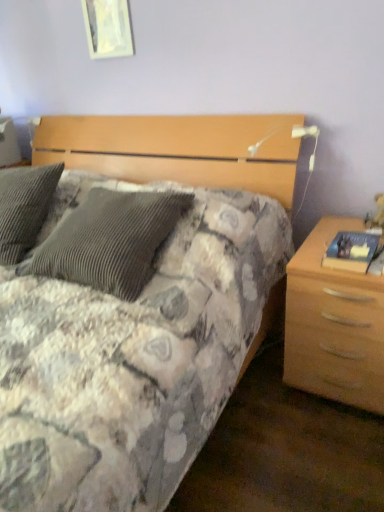
Question: Considering their positions, is white glossy picture frame at upper center located in front of or behind light wood/texture nightstand at right?

Choices:
 (A) behind
 (B) front

Answer: (A)

Question: From the image's perspective, relative to light wood/texture nightstand at right, is white glossy picture frame at upper center above or below?

Choices:
 (A) below
 (B) above

Answer: (B)

Question: In terms of width, does white glossy picture frame at upper center look wider or thinner when compared to light wood/texture nightstand at right?

Choices:
 (A) wide
 (B) thin

Answer: (B)

Question: Do you think light wood/texture nightstand at right is within white glossy picture frame at upper center, or outside of it?

Choices:
 (A) inside
 (B) outside

Answer: (B)

Question: Does point (347, 373) appear closer or farther from the camera than point (87, 23)?

Choices:
 (A) closer
 (B) farther

Answer: (A)

Question: From the image's perspective, is light wood/texture nightstand at right positioned above or below white glossy picture frame at upper center?

Choices:
 (A) below
 (B) above

Answer: (A)

Question: Is light wood/texture nightstand at right wider or thinner than white glossy picture frame at upper center?

Choices:
 (A) thin
 (B) wide

Answer: (B)